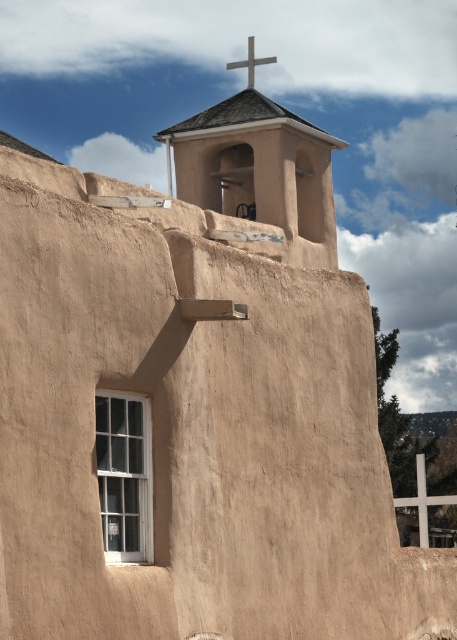
The image size is (457, 640). Identify the location of light brown stucco bell tower at upper center. (260, 168).

Is light brown stucco bell tower at upper center shorter than silver metallic cross at upper center?

No, light brown stucco bell tower at upper center is not shorter than silver metallic cross at upper center.

Locate an element on the screen. The width and height of the screenshot is (457, 640). light brown stucco bell tower at upper center is located at coordinates (260, 168).

The height and width of the screenshot is (640, 457). Identify the location of light brown stucco bell tower at upper center. (260, 168).